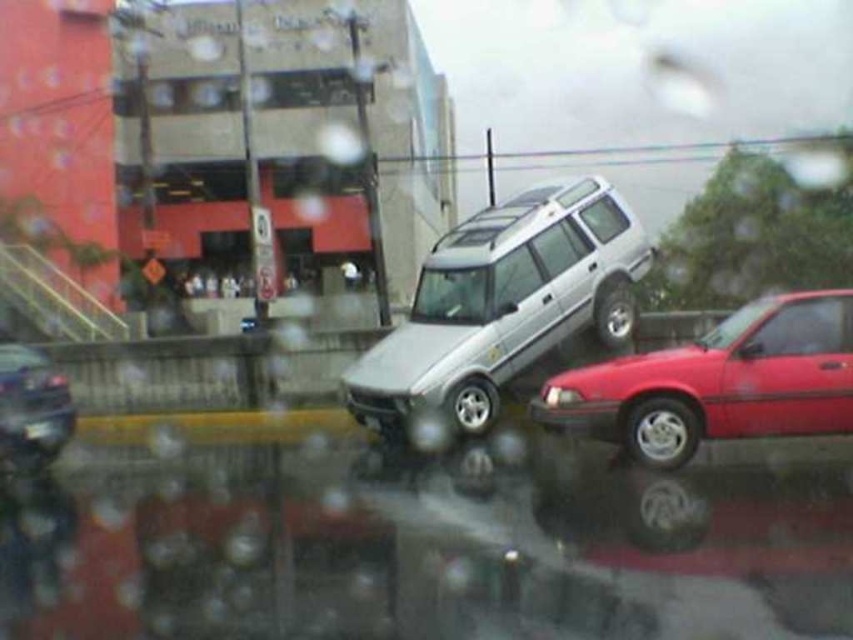
You are a delivery driver who needs to read the license plate number of the black plastic license plate at lower left. However, you can only see the shiny black sedan at lower left blocking part of it. Can you still read the entire license plate number?

The shiny black sedan at lower left is in front of the black plastic license plate at lower left, so part of the license plate is blocked by the car. Therefore, you cannot read the entire license plate number.

You are a delivery person needing to park your van between the shiny red sedan at right and the shiny black sedan at lower left. Based on their sizes, which side should you park closer to?

The shiny red sedan at right occupies less space than the shiny black sedan at lower left, so you should park closer to the shiny red sedan at right to accommodate your van between them.

You are a delivery driver who needs to park your vehicle in a space that can only accommodate cars up to the width of the shiny red sedan at right. You have a silver metallic suv at center. Can you safely park your vehicle in this space?

The silver metallic suv at center is wider than the shiny red sedan at right. Since the parking space can only accommodate cars up to the width of the shiny red sedan at right, the silver metallic suv at center cannot safely fit into this space.